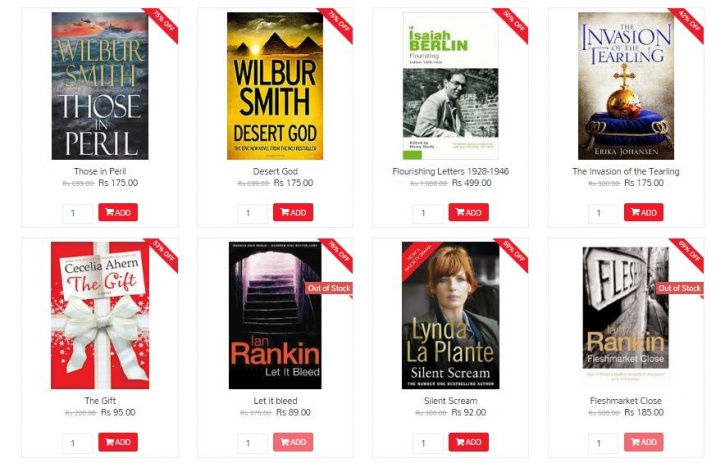
The image size is (725, 472). In order to click on book covers in this screenshot , I will do `click(621, 104)`, `click(457, 90)`, `click(267, 94)`, `click(104, 95)`, `click(96, 341)`, `click(302, 322)`, `click(470, 320)`, `click(634, 295)`.